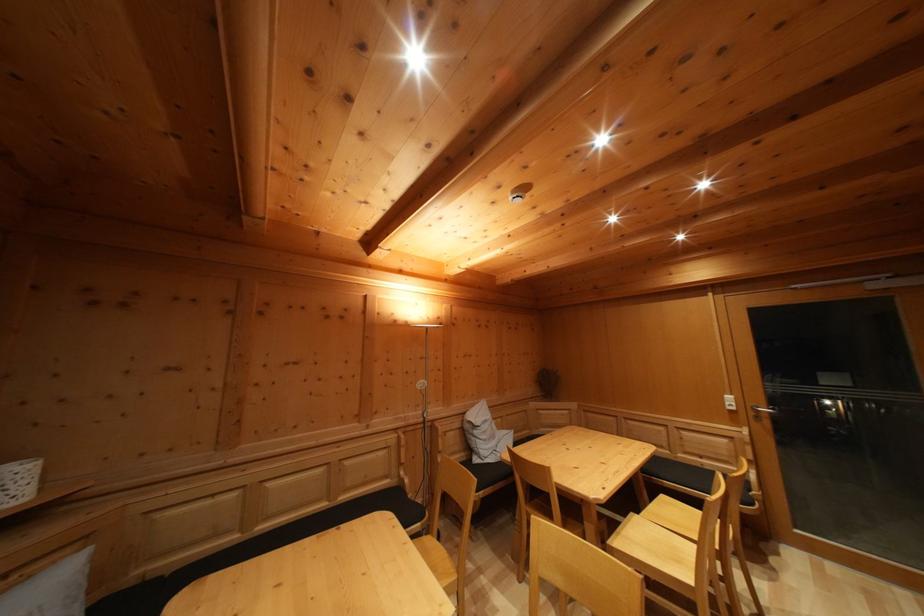
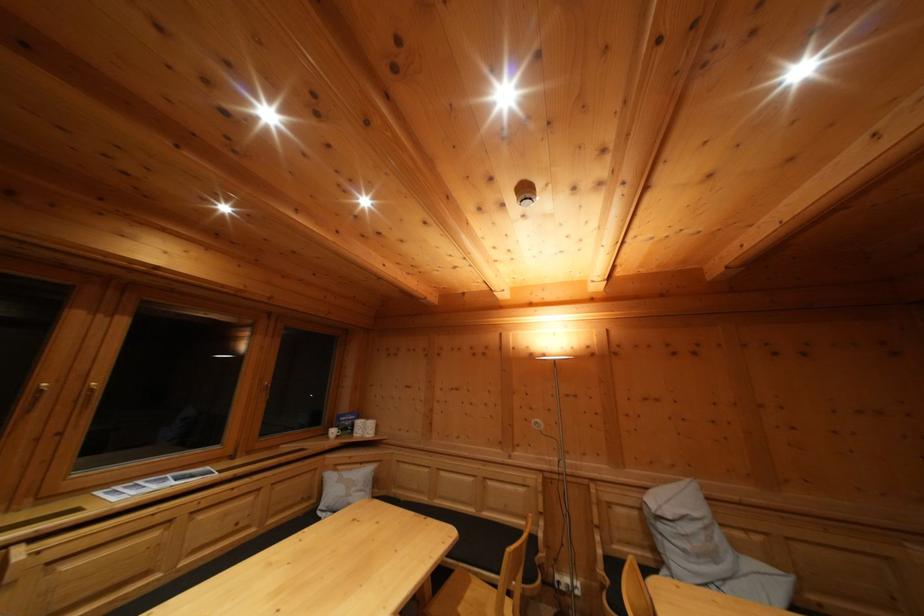
Find the pixel in the second image that matches the point at 392,484 in the first image.

(532, 525)